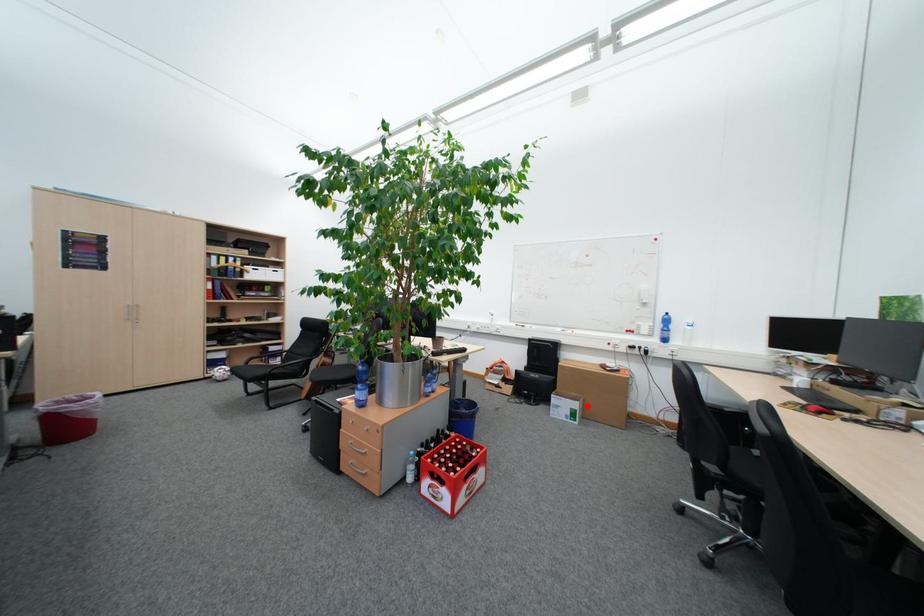
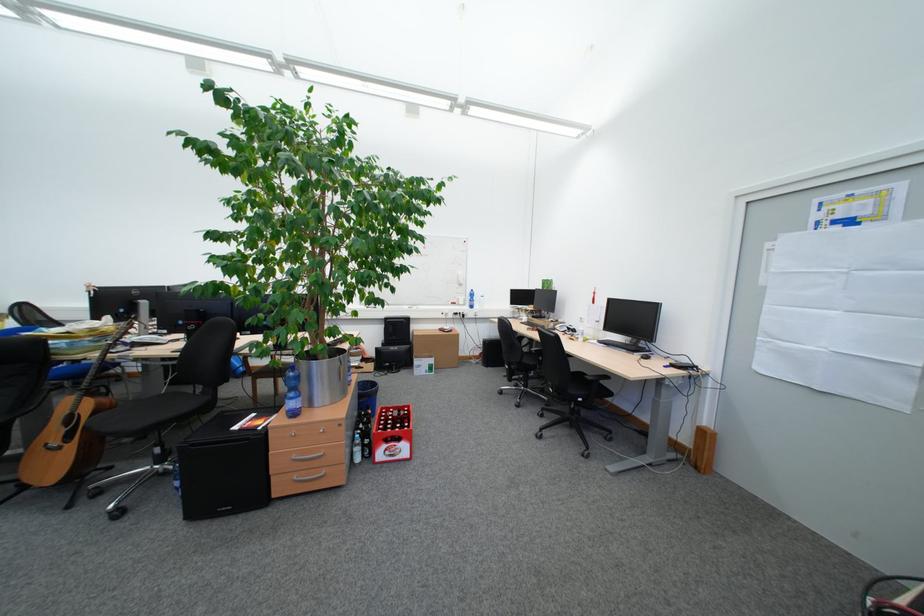
The point at the highlighted location is marked in the first image. Where is the corresponding point in the second image?

(444, 362)